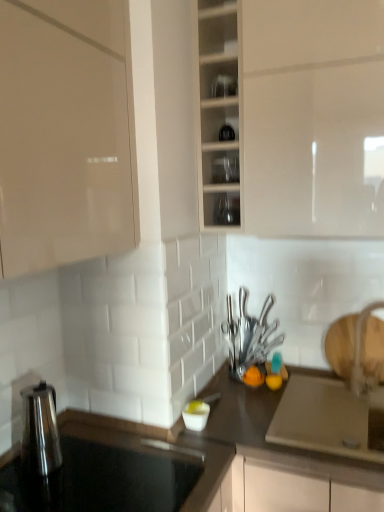
Question: Is white glossy bowl at center, the third tableware from the right, facing away from transparent glass jars at upper center, marked as the first shelf in a top-to-bottom arrangement?

Choices:
 (A) yes
 (B) no

Answer: (B)

Question: Does white glossy bowl at center, acting as the first tableware starting from the left, have a lesser width compared to transparent glass jars at upper center, the 2th shelf when ordered from bottom to top?

Choices:
 (A) yes
 (B) no

Answer: (A)

Question: Considering the relative sizes of white glossy bowl at center, the 3th tableware positioned from the top, and transparent glass jars at upper center, the 2th shelf when ordered from bottom to top, in the image provided, is white glossy bowl at center, the 3th tableware positioned from the top, smaller than transparent glass jars at upper center, the 2th shelf when ordered from bottom to top,?

Choices:
 (A) no
 (B) yes

Answer: (B)

Question: From a real-world perspective, is white glossy bowl at center, the first tableware in the bottom-to-top sequence, positioned over transparent glass jars at upper center, marked as the first shelf in a top-to-bottom arrangement, based on gravity?

Choices:
 (A) yes
 (B) no

Answer: (B)

Question: Are white glossy bowl at center, the first tableware in the bottom-to-top sequence, and transparent glass jars at upper center, the 2th shelf when ordered from bottom to top, far apart?

Choices:
 (A) yes
 (B) no

Answer: (A)

Question: Is white glossy faucet at right bigger or smaller than dark gray laminate countertop at center, the first countertop positioned from the right?

Choices:
 (A) small
 (B) big

Answer: (A)

Question: Does point (357, 360) appear closer or farther from the camera than point (256, 399)?

Choices:
 (A) closer
 (B) farther

Answer: (B)

Question: In terms of height, does white glossy faucet at right look taller or shorter compared to dark gray laminate countertop at center, which appears as the 2th countertop when viewed from the left?

Choices:
 (A) short
 (B) tall

Answer: (A)

Question: From a real-world perspective, relative to dark gray laminate countertop at center, the first countertop positioned from the right, is white glossy faucet at right vertically above or below?

Choices:
 (A) below
 (B) above

Answer: (B)

Question: In terms of width, does white glossy faucet at right look wider or thinner when compared to transparent glass cabinet at center?

Choices:
 (A) wide
 (B) thin

Answer: (B)

Question: In terms of height, does white glossy faucet at right look taller or shorter compared to transparent glass cabinet at center?

Choices:
 (A) tall
 (B) short

Answer: (B)

Question: Would you say white glossy faucet at right is inside or outside transparent glass cabinet at center?

Choices:
 (A) outside
 (B) inside

Answer: (A)

Question: Based on their sizes in the image, would you say white glossy faucet at right is bigger or smaller than transparent glass cabinet at center?

Choices:
 (A) big
 (B) small

Answer: (B)

Question: Considering the positions of point (365, 307) and point (271, 297), is point (365, 307) closer or farther from the camera than point (271, 297)?

Choices:
 (A) closer
 (B) farther

Answer: (A)

Question: Considering the positions of white glossy faucet at right and polished silver knife set at center, arranged as the 1th tableware when viewed from the back, in the image, is white glossy faucet at right bigger or smaller than polished silver knife set at center, arranged as the 1th tableware when viewed from the back,?

Choices:
 (A) small
 (B) big

Answer: (B)